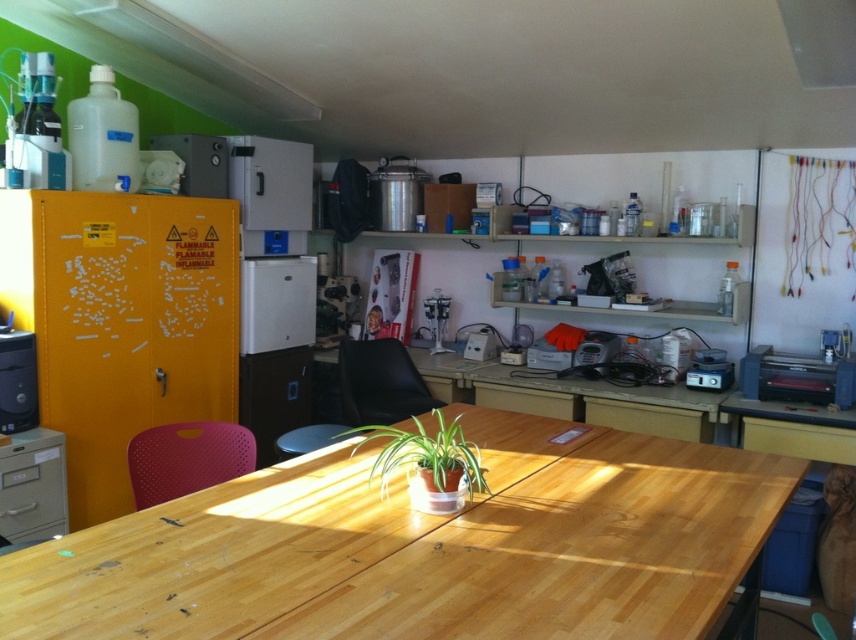
You are a researcher in the lab and need to place a new item between the green matte plant at center and the matte black computer tower at left. Based on their positions, where should you position the new item?

The green matte plant at center is located below the matte black computer tower at left, so you should position the new item between them by placing it in the space between the lower green matte plant at center and the higher matte black computer tower at left.

You are a researcher standing at the entrance of the lab. You need to move to the black leather chair at center to review some data. Based on the coordinates provided, can you estimate how far you are from the chair?

The black leather chair at center is located at coordinates point [379,381], so the researcher can estimate their distance by calculating the Euclidean distance from their current position to these coordinates.